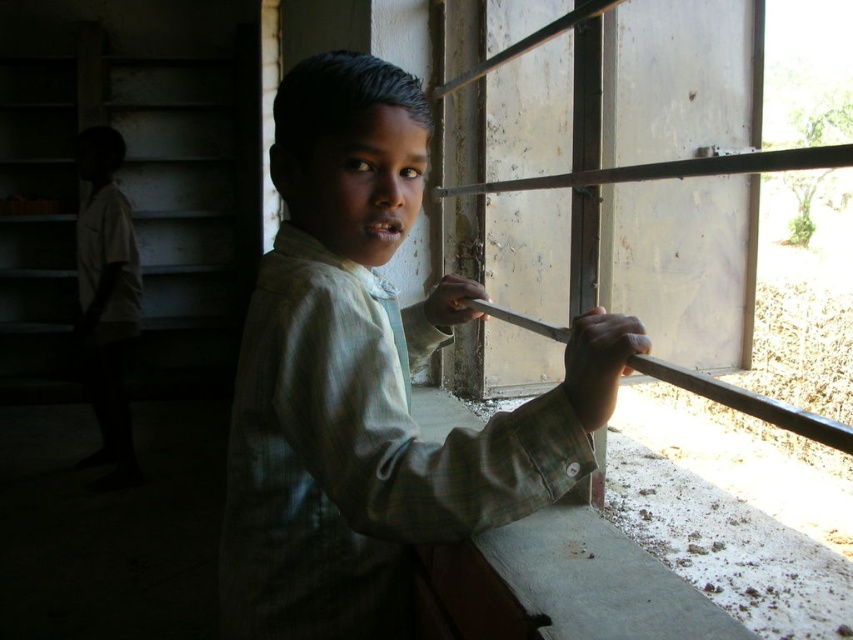
Question: In this image, where is green plaid shirt at center located relative to metallic smooth rail at upper right?

Choices:
 (A) right
 (B) left

Answer: (B)

Question: Does green plaid shirt at center lie in front of metallic smooth rail at upper right?

Choices:
 (A) no
 (B) yes

Answer: (A)

Question: Which object is farther from the camera taking this photo?

Choices:
 (A) metallic smooth rail at upper right
 (B) green plaid shirt at center

Answer: (B)

Question: Does green plaid shirt at center lie in front of metallic smooth rail at upper right?

Choices:
 (A) no
 (B) yes

Answer: (A)

Question: Which point is farther from the camera taking this photo?

Choices:
 (A) (680, 369)
 (B) (396, 109)

Answer: (A)